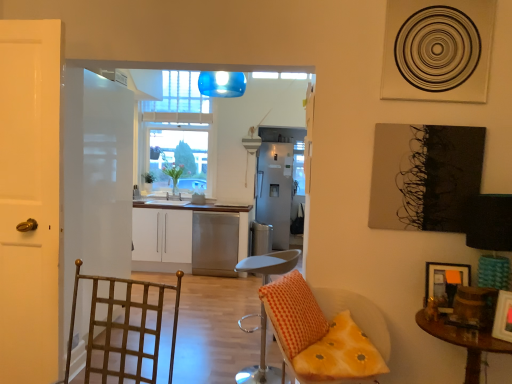
Measure the distance between point [432,269] and camera.

The distance of point [432,269] from camera is 2.42 meters.

Describe the element at coordinates (270, 263) in the screenshot. I see `orange fabric cushioned stool at center` at that location.

Find the location of a particular element. white glossy door at left, which is the second door in right-to-left order is located at coordinates (96, 178).

Locate an element on the screen. clear glass window at center is located at coordinates (179, 132).

The height and width of the screenshot is (384, 512). Find the location of `white glossy door at left, which ranks as the 1th door in right-to-left order`. white glossy door at left, which ranks as the 1th door in right-to-left order is located at coordinates (29, 199).

The image size is (512, 384). In order to click on metallic gold swivel chair at left in this screenshot , I will do click(x=122, y=328).

Image resolution: width=512 pixels, height=384 pixels. What do you see at coordinates (122, 328) in the screenshot? I see `metallic gold swivel chair at left` at bounding box center [122, 328].

The image size is (512, 384). Identify the location of wooden round table at lower right. point(464,342).

In terms of height, does wooden picture frame at lower right, positioned as the first picture frame in front-to-back order, look taller or shorter compared to white glossy door at left, positioned as the first door in front-to-back order?

In the image, wooden picture frame at lower right, positioned as the first picture frame in front-to-back order, appears to be shorter than white glossy door at left, positioned as the first door in front-to-back order.

From the image's perspective, relative to white glossy door at left, which ranks as the 1th door in right-to-left order, is wooden picture frame at lower right, positioned as the first picture frame in front-to-back order, above or below?

wooden picture frame at lower right, positioned as the first picture frame in front-to-back order, is situated lower than white glossy door at left, which ranks as the 1th door in right-to-left order, in the image.

Who is smaller, wooden picture frame at lower right, which ranks as the 2th picture frame in back-to-front order, or white glossy door at left, which is the 2th door from back to front?

wooden picture frame at lower right, which ranks as the 2th picture frame in back-to-front order.

Based on their sizes in the image, would you say wooden picture frame at lower right, which ranks as the second picture frame in front-to-back order, is bigger or smaller than wooden round table at lower right?

wooden picture frame at lower right, which ranks as the second picture frame in front-to-back order, is smaller than wooden round table at lower right.

Is wooden picture frame at lower right, which ranks as the second picture frame in front-to-back order, next to wooden round table at lower right and touching it?

There is a gap between wooden picture frame at lower right, which ranks as the second picture frame in front-to-back order, and wooden round table at lower right.

Which is closer, (466, 280) or (456, 333)?

Positioned in front is point (456, 333).

Who is shorter, wooden picture frame at lower right, positioned as the first picture frame in back-to-front order, or wooden round table at lower right?

wooden picture frame at lower right, positioned as the first picture frame in back-to-front order.

Considering the relative sizes of white glossy door at left, which is the 2th door in front-to-back order, and orange fabric cushioned stool at center in the image provided, is white glossy door at left, which is the 2th door in front-to-back order, smaller than orange fabric cushioned stool at center?

Actually, white glossy door at left, which is the 2th door in front-to-back order, might be larger than orange fabric cushioned stool at center.

Considering the sizes of objects white glossy door at left, which is the second door in right-to-left order, and orange fabric cushioned stool at center in the image provided, who is thinner, white glossy door at left, which is the second door in right-to-left order, or orange fabric cushioned stool at center?

white glossy door at left, which is the second door in right-to-left order, is thinner.

Is orange fabric cushioned stool at center at the back of white glossy door at left, which is the 2th door in front-to-back order?

No.

How many degrees apart are the facing directions of white glossy door at left, the first door when ordered from left to right, and orange fabric cushioned stool at center?

164 degrees separate the facing orientations of white glossy door at left, the first door when ordered from left to right, and orange fabric cushioned stool at center.

Are orange checkered pillow at center and yellow fabric cushion at lower right making contact?

Absolutely, orange checkered pillow at center is next to and touching yellow fabric cushion at lower right.

Between orange checkered pillow at center and yellow fabric cushion at lower right, which one has smaller size?

With smaller size is orange checkered pillow at center.

Is orange checkered pillow at center to the left of yellow fabric cushion at lower right from the viewer's perspective?

Correct, you'll find orange checkered pillow at center to the left of yellow fabric cushion at lower right.

From the picture: Does orange checkered pillow at center have a lesser width compared to yellow fabric cushion at lower right?

Yes, orange checkered pillow at center is thinner than yellow fabric cushion at lower right.

Is satin silver refrigerator at center touching wooden round table at lower right?

They are not placed beside each other.

Which object is positioned more to the right, satin silver refrigerator at center or wooden round table at lower right?

wooden round table at lower right is more to the right.

In the scene shown: From a real-world perspective, does satin silver refrigerator at center stand above wooden round table at lower right?

Correct, in the physical world, satin silver refrigerator at center is higher than wooden round table at lower right.

Which is correct: satin silver refrigerator at center is inside wooden round table at lower right, or outside of it?

satin silver refrigerator at center is located beyond the bounds of wooden round table at lower right.

From a real-world perspective, is white glossy cabinets at center on top of white glossy door at left, which is the second door in right-to-left order?

No, from a real-world perspective, white glossy cabinets at center is not over white glossy door at left, which is the second door in right-to-left order

In terms of height, does white glossy cabinets at center look taller or shorter compared to white glossy door at left, which is the second door in right-to-left order?

white glossy cabinets at center is shorter than white glossy door at left, which is the second door in right-to-left order.

Is white glossy cabinets at center facing away from white glossy door at left, the first door when ordered from left to right?

No, white glossy door at left, the first door when ordered from left to right, is not at the back of white glossy cabinets at center.

Is white glossy cabinets at center closer to the viewer compared to white glossy door at left, the first door when ordered from left to right?

That is False.

Based on the photo, from the image's perspective, which is below, wooden picture frame at lower right, positioned as the first picture frame in back-to-front order, or wooden picture frame at lower right, positioned as the first picture frame in front-to-back order?

wooden picture frame at lower right, positioned as the first picture frame in front-to-back order, from the image's perspective.

Which object is positioned more to the left, wooden picture frame at lower right, which ranks as the second picture frame in front-to-back order, or wooden picture frame at lower right, positioned as the first picture frame in front-to-back order?

wooden picture frame at lower right, which ranks as the second picture frame in front-to-back order.

Locate an element on the screen. The width and height of the screenshot is (512, 384). picture frame on the left of the wooden picture frame at lower right, positioned as the first picture frame in front-to-back order is located at coordinates (x=445, y=283).

Is wooden picture frame at lower right, which ranks as the second picture frame in front-to-back order, situated inside wooden picture frame at lower right, positioned as the first picture frame in front-to-back order, or outside?

wooden picture frame at lower right, which ranks as the second picture frame in front-to-back order, is not inside wooden picture frame at lower right, positioned as the first picture frame in front-to-back order, it's outside.

Identify the location of door in front of the wooden picture frame at lower right, positioned as the first picture frame in front-to-back order. (29, 199).

There is a wooden round table at lower right. Where is `the 2nd picture frame above it (from a real-world perspective)`? The height and width of the screenshot is (384, 512). the 2nd picture frame above it (from a real-world perspective) is located at coordinates (445, 283).

Looking at the image, which one is located closer to wooden picture frame at lower right, positioned as the first picture frame in front-to-back order, orange fabric cushioned stool at center or wooden round table at lower right?

wooden round table at lower right.

Looking at the image, which one is located further to clear glass window at center, metallic gold swivel chair at left or orange checkered pillow at center?

Among the two, orange checkered pillow at center is located further to clear glass window at center.

Considering their positions, is orange fabric cushioned stool at center positioned closer to metallic gold swivel chair at left than white glossy door at left, the first door viewed from the back?

white glossy door at left, the first door viewed from the back, is positioned closer to the anchor metallic gold swivel chair at left.

From the image, which object appears to be nearer to wooden round table at lower right, metallic gold swivel chair at left or wooden picture frame at lower right, which ranks as the 2th picture frame in back-to-front order?

wooden picture frame at lower right, which ranks as the 2th picture frame in back-to-front order, is closer to wooden round table at lower right.

Which object lies nearer to the anchor point orange checkered pillow at center, satin silver refrigerator at center or white glossy door at left, which is the 2th door in front-to-back order?

white glossy door at left, which is the 2th door in front-to-back order.

From the image, which object appears to be farther from yellow fabric cushion at lower right, metallic gold swivel chair at left or white glossy door at left, the first door viewed from the back?

white glossy door at left, the first door viewed from the back.

Consider the image. From the image, which object appears to be nearer to clear glass window at center, white glossy cabinets at center or wooden picture frame at lower right, which ranks as the 2th picture frame in back-to-front order?

white glossy cabinets at center.

From the image, which object appears to be nearer to yellow fabric cushion at lower right, clear glass window at center or white glossy cabinets at center?

white glossy cabinets at center lies closer to yellow fabric cushion at lower right than the other object.

Locate an element on the screen. The height and width of the screenshot is (384, 512). picture frame located between white glossy door at left, acting as the 2th door starting from the left, and wooden picture frame at lower right, positioned as the first picture frame in front-to-back order, in the left-right direction is located at coordinates (445, 283).

Where is `chair positioned between metallic gold swivel chair at left and orange checkered pillow at center from near to far`? chair positioned between metallic gold swivel chair at left and orange checkered pillow at center from near to far is located at coordinates (318, 334).

At what (x,y) coordinates should I click in order to perform the action: click on swivel chair located between white glossy door at left, which is the 2th door from back to front, and wooden picture frame at lower right, positioned as the first picture frame in back-to-front order, in the left-right direction. Please return your answer as a coordinate pair (x, y). Image resolution: width=512 pixels, height=384 pixels. Looking at the image, I should click on (122, 328).

At what (x,y) coordinates should I click in order to perform the action: click on picture frame between wooden picture frame at lower right, positioned as the first picture frame in front-to-back order, and satin silver refrigerator at center from front to back. Please return your answer as a coordinate pair (x, y). The image size is (512, 384). Looking at the image, I should click on (445, 283).